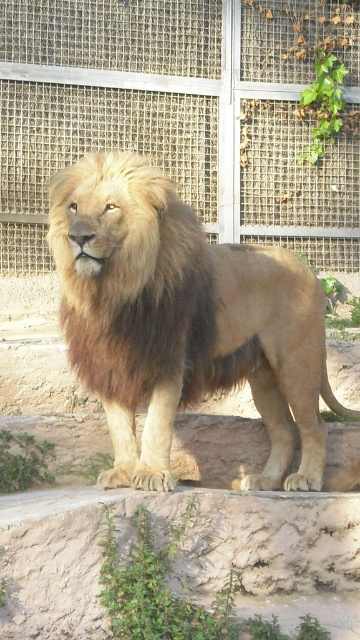
Can you confirm if metal mesh fence at upper center is smaller than golden fur lion at center?

Yes.

Can you confirm if metal mesh fence at upper center is positioned below golden fur lion at center?

No.

Is point (115, 131) positioned behind point (87, 157)?

Yes, point (115, 131) is behind point (87, 157).

Where is `metal mesh fence at upper center`? The image size is (360, 640). metal mesh fence at upper center is located at coordinates (183, 115).